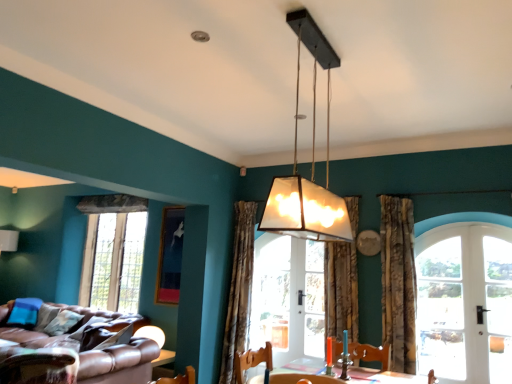
Image resolution: width=512 pixels, height=384 pixels. Describe the element at coordinates (113, 252) in the screenshot. I see `clear glass window at left, which appears as the first window when viewed from the left` at that location.

The image size is (512, 384). What are the coordinates of `floral fabric curtain at right, acting as the 3th curtain starting from the left` in the screenshot? It's located at (398, 282).

What is the approximate width of matte glass lampshade at center?

9.41 inches.

This screenshot has width=512, height=384. What do you see at coordinates (77, 353) in the screenshot? I see `brown leather couch at lower left` at bounding box center [77, 353].

Image resolution: width=512 pixels, height=384 pixels. Identify the location of patterned fabric curtain at center, placed as the 1th curtain when sorted from left to right. (239, 289).

Based on the photo, which is farther, (242,312) or (329,69)?

The point (242,312) is behind.

Is matte glass lampshade at center at the back of patterned fabric curtain at center, placed as the 1th curtain when sorted from left to right?

patterned fabric curtain at center, placed as the 1th curtain when sorted from left to right, does not have its back to matte glass lampshade at center.

Considering the relative sizes of patterned fabric curtain at center, acting as the 3th curtain starting from the right, and matte glass lampshade at center in the image provided, is patterned fabric curtain at center, acting as the 3th curtain starting from the right, thinner than matte glass lampshade at center?

No.

Does patterned fabric curtain at center, acting as the 3th curtain starting from the right, appear on the right side of matte glass lampshade at center?

No, patterned fabric curtain at center, acting as the 3th curtain starting from the right, is not to the right of matte glass lampshade at center.

Is clear glass window at left, which ranks as the 2th window in right-to-left order, positioned in front of floral fabric curtain at right, acting as the 3th curtain starting from the left?

No, it is not.

Is clear glass window at left, arranged as the second window when viewed from the front, bigger or smaller than floral fabric curtain at right, acting as the 3th curtain starting from the left?

Considering their sizes, clear glass window at left, arranged as the second window when viewed from the front, takes up more space than floral fabric curtain at right, acting as the 3th curtain starting from the left.

Considering the sizes of objects clear glass window at left, which appears as the first window when viewed from the left, and floral fabric curtain at right, acting as the 3th curtain starting from the left, in the image provided, who is wider, clear glass window at left, which appears as the first window when viewed from the left, or floral fabric curtain at right, acting as the 3th curtain starting from the left,?

Wider between the two is floral fabric curtain at right, acting as the 3th curtain starting from the left.

Is patterned fabric curtain at center, placed as the 1th curtain when sorted from left to right, oriented towards white glass door at right, which is counted as the second window, starting from the back?

No, patterned fabric curtain at center, placed as the 1th curtain when sorted from left to right, is not oriented towards white glass door at right, which is counted as the second window, starting from the back.

Can we say patterned fabric curtain at center, placed as the 1th curtain when sorted from left to right, lies outside white glass door at right, which is counted as the second window, starting from the back?

patterned fabric curtain at center, placed as the 1th curtain when sorted from left to right, lies outside white glass door at right, which is counted as the second window, starting from the back,'s area.

Looking at the image, does patterned fabric curtain at center, acting as the 3th curtain starting from the right, seem bigger or smaller compared to white glass door at right, positioned as the first window in right-to-left order?

patterned fabric curtain at center, acting as the 3th curtain starting from the right, is bigger than white glass door at right, positioned as the first window in right-to-left order.

Which point is more forward, (231, 278) or (438, 356)?

The point (438, 356) is in front.

Considering the sizes of clear glass window at left, which ranks as the 2th window in right-to-left order, and leather swivel chair at lower left, which ranks as the first swivel chair in left-to-right order, in the image, is clear glass window at left, which ranks as the 2th window in right-to-left order, taller or shorter than leather swivel chair at lower left, which ranks as the first swivel chair in left-to-right order,?

clear glass window at left, which ranks as the 2th window in right-to-left order, is taller than leather swivel chair at lower left, which ranks as the first swivel chair in left-to-right order.

From a real-world perspective, which is physically below, clear glass window at left, which ranks as the 2th window in right-to-left order, or leather swivel chair at lower left, which ranks as the first swivel chair in left-to-right order?

leather swivel chair at lower left, which ranks as the first swivel chair in left-to-right order, from a real-world perspective.

Is clear glass window at left, which is counted as the 1th window, starting from the back, positioned in front of leather swivel chair at lower left, which ranks as the first swivel chair in left-to-right order?

No.

Measure the distance between clear glass window at left, which is counted as the 1th window, starting from the back, and leather swivel chair at lower left, which ranks as the first swivel chair in left-to-right order.

clear glass window at left, which is counted as the 1th window, starting from the back, and leather swivel chair at lower left, which ranks as the first swivel chair in left-to-right order, are 7.44 feet apart.

Is brown leather couch at lower left completely or partially inside clear glass door at right?

No, brown leather couch at lower left is not inside clear glass door at right.

How different are the orientations of clear glass door at right and brown leather couch at lower left in degrees?

The angle between the facing direction of clear glass door at right and the facing direction of brown leather couch at lower left is 1.08 degrees.

Considering the sizes of objects clear glass door at right and brown leather couch at lower left in the image provided, who is smaller, clear glass door at right or brown leather couch at lower left?

clear glass door at right.

Which object is closer to the camera, clear glass door at right or brown leather couch at lower left?

clear glass door at right is closer to the camera.

Is floral fabric curtain at right, acting as the 3th curtain starting from the left, looking in the opposite direction of clear glass door at right?

No, floral fabric curtain at right, acting as the 3th curtain starting from the left, is not facing away from clear glass door at right.

There is a clear glass door at right. Where is `the 3rd curtain above it (from a real-world perspective)`? Image resolution: width=512 pixels, height=384 pixels. the 3rd curtain above it (from a real-world perspective) is located at coordinates (398, 282).

Which is correct: floral fabric curtain at right, acting as the 3th curtain starting from the left, is inside clear glass door at right, or outside of it?

floral fabric curtain at right, acting as the 3th curtain starting from the left, exists outside the volume of clear glass door at right.

Can you confirm if floral fabric curtain at right, which is counted as the 1th curtain, starting from the right, is thinner than clear glass door at right?

No.

From the image's perspective, is white glass door at right, which is the 2th window in left-to-right order, above or below wooden swivel chair at lower center, the first swivel chair in the right-to-left sequence?

Clearly, from the image's perspective, white glass door at right, which is the 2th window in left-to-right order, is above wooden swivel chair at lower center, the first swivel chair in the right-to-left sequence.

Does white glass door at right, the first window positioned from the front, contain wooden swivel chair at lower center, the first swivel chair in the right-to-left sequence?

No, wooden swivel chair at lower center, the first swivel chair in the right-to-left sequence, is located outside of white glass door at right, the first window positioned from the front.

Is white glass door at right, which is counted as the second window, starting from the back, in contact with wooden swivel chair at lower center, the first swivel chair in the right-to-left sequence?

white glass door at right, which is counted as the second window, starting from the back, and wooden swivel chair at lower center, the first swivel chair in the right-to-left sequence, are clearly separated.

Find the location of `curtain that is the 3rd one below the matte glass lampshade at center (from a real-world perspective)`. curtain that is the 3rd one below the matte glass lampshade at center (from a real-world perspective) is located at coordinates (239, 289).

Find the location of `the 2nd curtain above the clear glass window at left, which is counted as the 1th window, starting from the back (from the image's perspective)`. the 2nd curtain above the clear glass window at left, which is counted as the 1th window, starting from the back (from the image's perspective) is located at coordinates (398, 282).

Estimate the real-world distances between objects in this image. Which object is further from patterned fabric curtain at center, placed as the 1th curtain when sorted from left to right, clear glass window at left, which appears as the first window when viewed from the left, or white glass door at right, which is counted as the second window, starting from the back?

Based on the image, white glass door at right, which is counted as the second window, starting from the back, appears to be further to patterned fabric curtain at center, placed as the 1th curtain when sorted from left to right.

Based on their spatial positions, is clear glass window at left, which appears as the first window when viewed from the left, or clear glass door at right further from matte glass lampshade at center?

clear glass window at left, which appears as the first window when viewed from the left, lies further to matte glass lampshade at center than the other object.

Considering their positions, is clear glass door at right positioned closer to leather swivel chair at lower left, acting as the 2th swivel chair starting from the right, than floral fabric curtain at right, acting as the 3th curtain starting from the left?

floral fabric curtain at right, acting as the 3th curtain starting from the left, is positioned closer to the anchor leather swivel chair at lower left, acting as the 2th swivel chair starting from the right.

When comparing their distances from leather swivel chair at lower left, acting as the 2th swivel chair starting from the right, does textured beige curtain at center, the 2th curtain from the left, or wooden swivel chair at lower center, which ranks as the second swivel chair in left-to-right order, seem closer?

wooden swivel chair at lower center, which ranks as the second swivel chair in left-to-right order, is positioned closer to the anchor leather swivel chair at lower left, acting as the 2th swivel chair starting from the right.

When comparing their distances from matte glass lampshade at center, does wooden swivel chair at lower center, the first swivel chair in the right-to-left sequence, or leather swivel chair at lower left, acting as the 2th swivel chair starting from the right, seem closer?

Among the two, wooden swivel chair at lower center, the first swivel chair in the right-to-left sequence, is located nearer to matte glass lampshade at center.

From the image, which object appears to be nearer to leather swivel chair at lower left, which ranks as the first swivel chair in left-to-right order, clear glass window at left, arranged as the second window when viewed from the front, or wooden swivel chair at lower center, the first swivel chair in the right-to-left sequence?

clear glass window at left, arranged as the second window when viewed from the front, is closer to leather swivel chair at lower left, which ranks as the first swivel chair in left-to-right order.

Looking at this image, based on their spatial positions, is leather swivel chair at lower left, which ranks as the first swivel chair in left-to-right order, or brown leather couch at lower left closer to clear glass door at right?

brown leather couch at lower left lies closer to clear glass door at right than the other object.

Which object lies further to the anchor point wooden swivel chair at lower center, the first swivel chair in the right-to-left sequence, floral fabric curtain at right, which is counted as the 1th curtain, starting from the right, or clear glass window at left, arranged as the second window when viewed from the front?

clear glass window at left, arranged as the second window when viewed from the front, is positioned further to the anchor wooden swivel chair at lower center, the first swivel chair in the right-to-left sequence.

Locate an element on the screen. This screenshot has height=384, width=512. lamp between brown leather couch at lower left and clear glass door at right is located at coordinates (312, 162).

The height and width of the screenshot is (384, 512). In order to click on window between brown leather couch at lower left and patterned fabric curtain at center, placed as the 1th curtain when sorted from left to right, in the horizontal direction in this screenshot , I will do `click(113, 252)`.

In order to click on lamp between brown leather couch at lower left and textured beige curtain at center, the 2th curtain from the left, in the horizontal direction in this screenshot , I will do `click(312, 162)`.

This screenshot has height=384, width=512. What are the coordinates of `curtain between leather swivel chair at lower left, which ranks as the first swivel chair in left-to-right order, and wooden swivel chair at lower center, which ranks as the second swivel chair in left-to-right order, from left to right` in the screenshot? It's located at (239, 289).